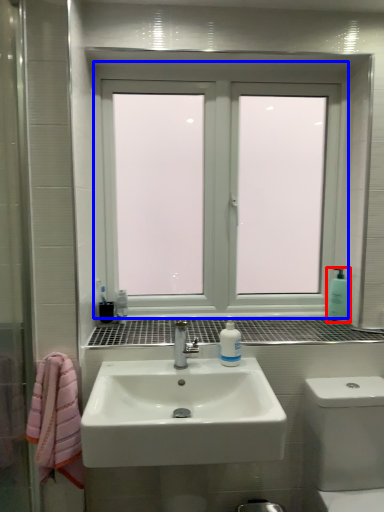
Question: Which of the following is the farthest to the observer, soap dispenser (highlighted by a red box) or window (highlighted by a blue box)?

Choices:
 (A) soap dispenser
 (B) window

Answer: (A)